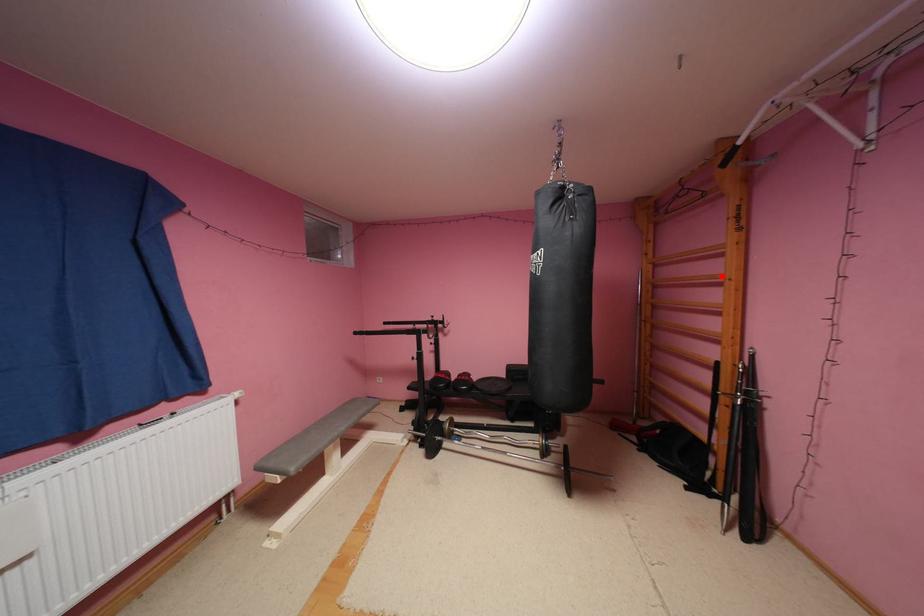
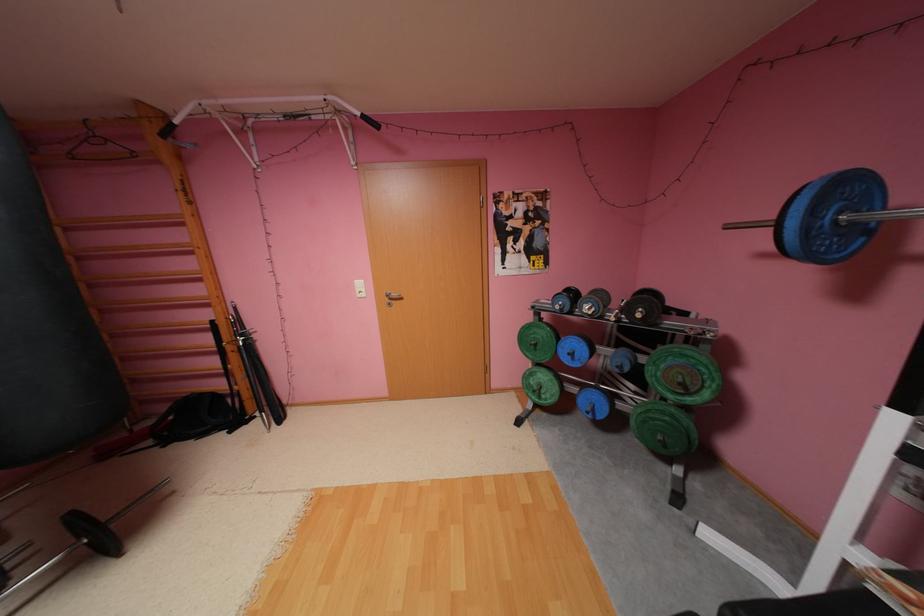
Find the pixel in the second image that matches the highlighted location in the first image.

(187, 245)